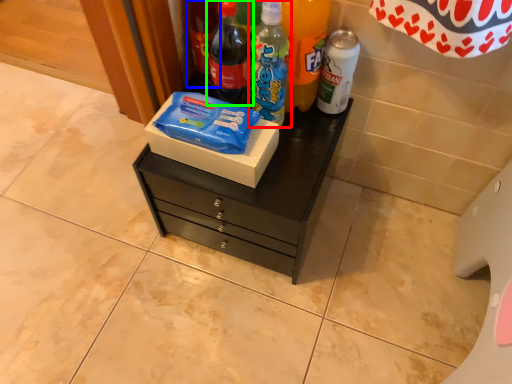
Question: Based on their relative distances, which object is nearer to bottle (highlighted by a red box)? Choose from bottle (highlighted by a blue box) and bottle (highlighted by a green box).

Choices:
 (A) bottle
 (B) bottle

Answer: (B)